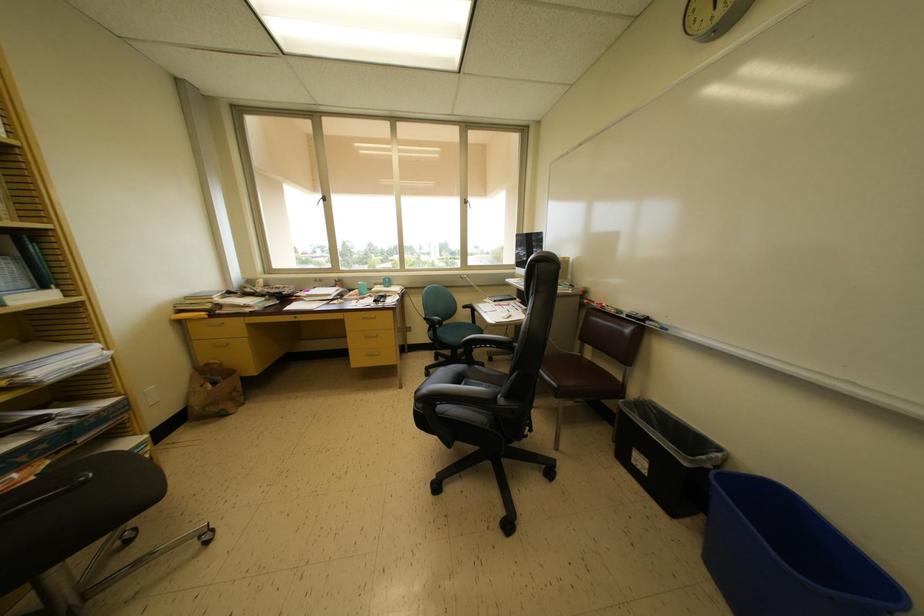
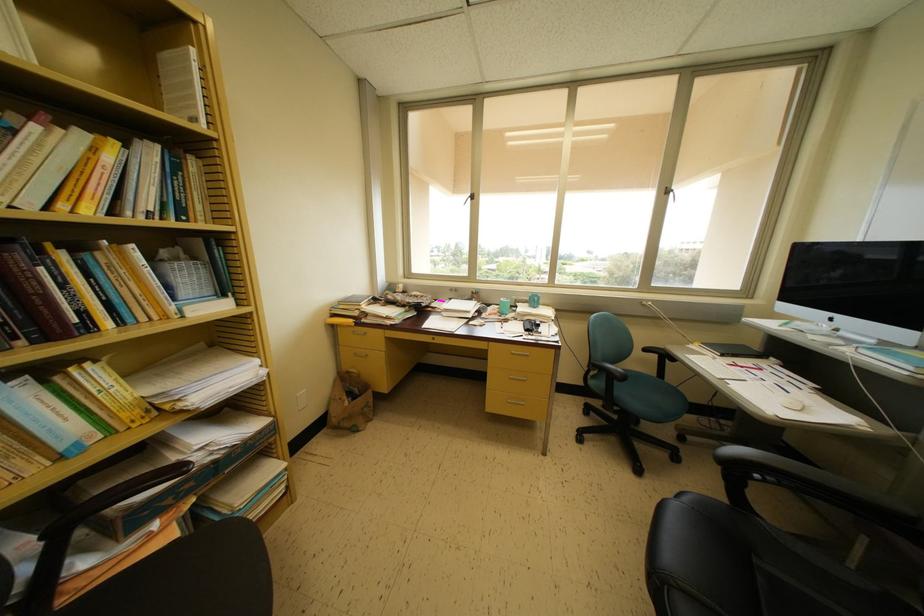
Find the pixel in the second image that matches [392,288] in the first image.

(538, 306)